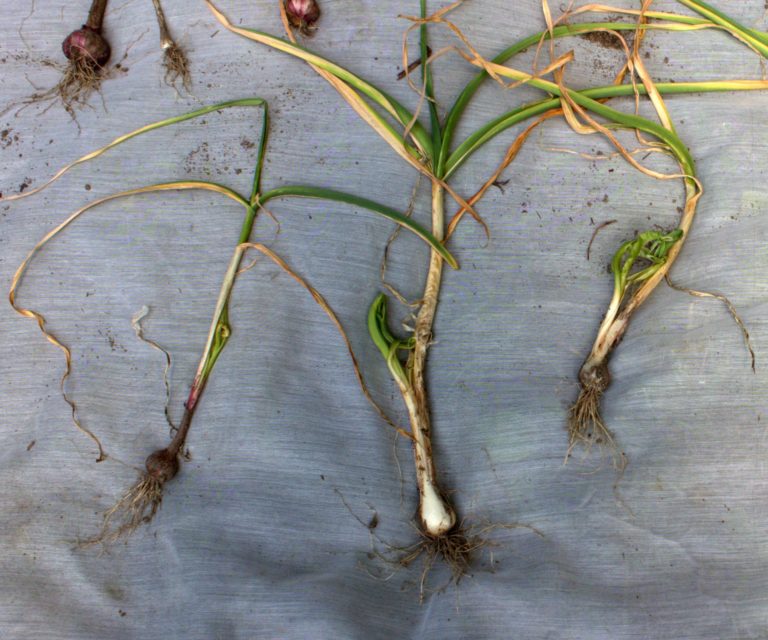
You are a GUI agent. You are given a task and a screenshot of the screen. Output one action in this format:
    pyautogui.click(x=<x>, y=<y>)
    Task: Click on the bulb
    The height and width of the screenshot is (640, 768).
    Given the screenshot: What is the action you would take?
    pyautogui.click(x=85, y=45)